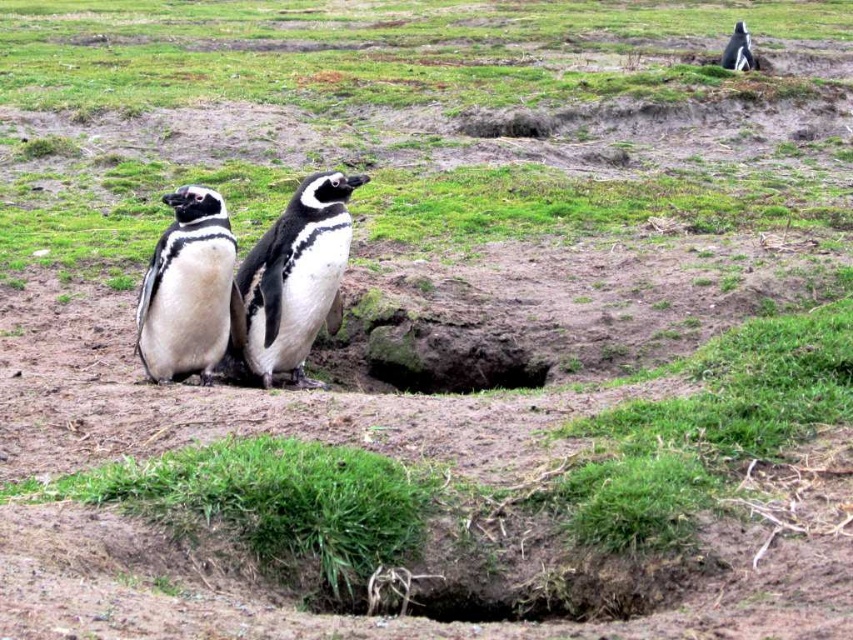
Does black and white feathers at center come behind dark soil hole at center?

No.

Between black and white feathers at center and dark soil hole at center, which one is positioned higher?

black and white feathers at center

Identify the location of black and white feathers at center. (189, 291).

Identify the location of black and white feathers at center. (189, 291).

Is dark soil hole at center bigger than black glossy penguin at upper right?

No, dark soil hole at center is not bigger than black glossy penguin at upper right.

Is point (457, 349) positioned after point (723, 51)?

No.

What do you see at coordinates (450, 356) in the screenshot?
I see `dark soil hole at center` at bounding box center [450, 356].

Locate an element on the screen. Image resolution: width=853 pixels, height=640 pixels. dark soil hole at center is located at coordinates (450, 356).

Who is positioned more to the right, white glossy penguin at center or dark soil hole at center?

From the viewer's perspective, dark soil hole at center appears more on the right side.

Who is shorter, white glossy penguin at center or dark soil hole at center?

Standing shorter between the two is dark soil hole at center.

The height and width of the screenshot is (640, 853). What do you see at coordinates (294, 278) in the screenshot?
I see `white glossy penguin at center` at bounding box center [294, 278].

Locate an element on the screen. white glossy penguin at center is located at coordinates (294, 278).